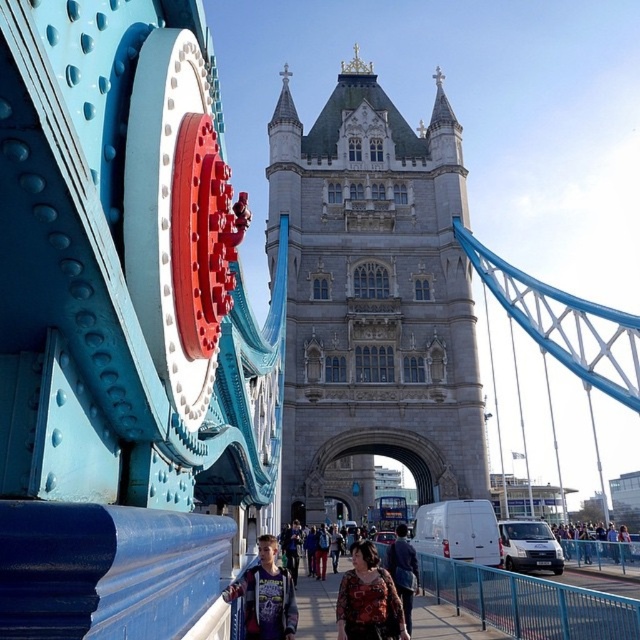
Question: Among these objects, which one is nearest to the camera?

Choices:
 (A) floral-patterned blouse at center
 (B) dark blue jeans at lower right
 (C) dark blue jacket at center
 (D) floral fabric dress at center

Answer: (C)

Question: Does floral-patterned blouse at center have a larger size compared to dark blue jacket at center?

Choices:
 (A) no
 (B) yes

Answer: (B)

Question: Among these objects, which one is farthest from the camera?

Choices:
 (A) gray stone tower at center
 (B) floral fabric dress at center
 (C) dark blue jeans at lower right

Answer: (C)

Question: Which of the following is the farthest from the observer?

Choices:
 (A) (412, 548)
 (B) (618, 561)
 (C) (381, 611)

Answer: (B)

Question: Is gray stone tower at center closer to the viewer compared to matte blue pavement at center?

Choices:
 (A) no
 (B) yes

Answer: (A)

Question: Is the position of floral-patterned blouse at center more distant than that of dark blue jacket at center?

Choices:
 (A) yes
 (B) no

Answer: (A)